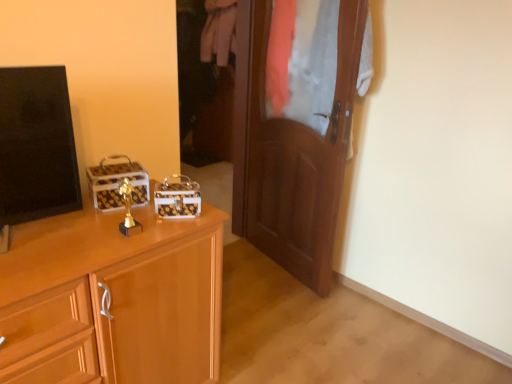
Where is `free location to the right of black glossy tv at left`? The width and height of the screenshot is (512, 384). free location to the right of black glossy tv at left is located at coordinates [x=98, y=238].